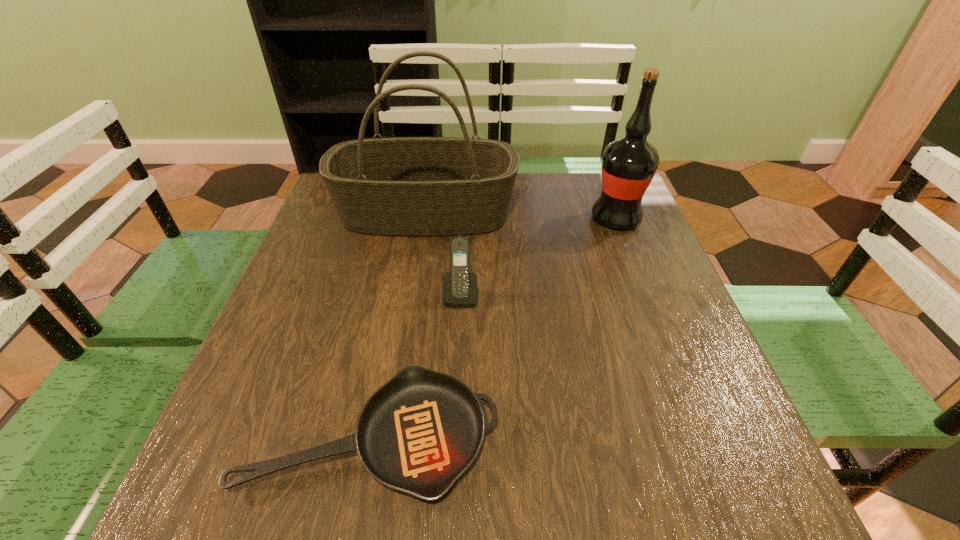
The height and width of the screenshot is (540, 960). What are the coordinates of `vacant space at the near edge of the desktop` in the screenshot? It's located at (344, 494).

In the image, there is a desktop. What are the coordinates of `vacant space at the left edge` in the screenshot? It's located at (300, 274).

Locate an element on the screen. The width and height of the screenshot is (960, 540). vacant space at the right edge of the desktop is located at coordinates (627, 247).

Where is `free space at the far right corner of the desktop`? This screenshot has height=540, width=960. free space at the far right corner of the desktop is located at coordinates (586, 187).

Image resolution: width=960 pixels, height=540 pixels. In order to click on free point between the rightmost object and the basket in this screenshot , I will do coord(520,216).

This screenshot has width=960, height=540. In order to click on vacant area that lies between the basket and the rightmost object in this screenshot , I will do `click(520, 216)`.

The height and width of the screenshot is (540, 960). I want to click on free point between the basket and the nearest object, so click(x=399, y=325).

Identify the location of unoccupied area between the rightmost object and the shortest object. (494, 327).

Locate an element on the screen. Image resolution: width=960 pixels, height=540 pixels. vacant space that is in between the basket and the nearest object is located at coordinates (399, 325).

Identify the location of vacant area between the cellular telephone and the basket. (444, 255).